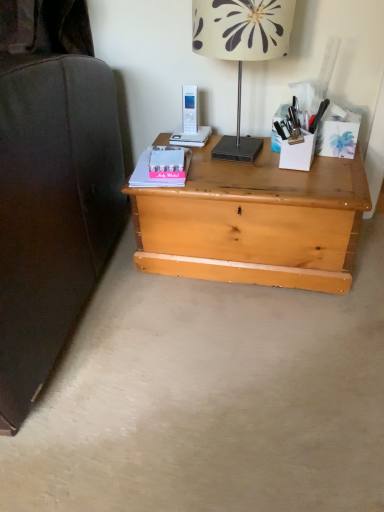
Locate an element on the screen. free space above light wood chest at center (from a real-world perspective) is located at coordinates (265, 170).